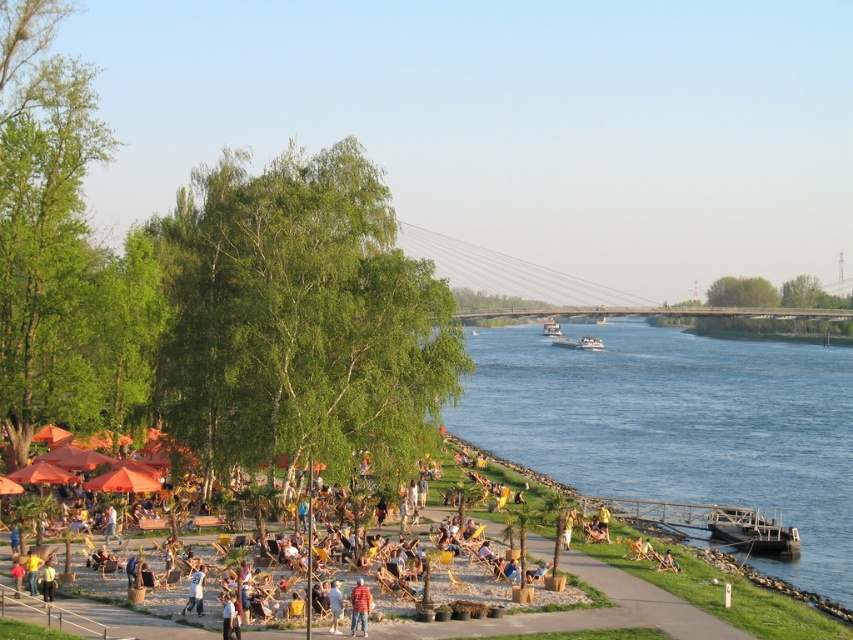
You are standing at the center of the sandy beach and want to reach the blue water at center. According to the coordinates provided, in which direction should you walk to get there?

The blue water at center is located at coordinates point 0.667 on the x axis and 0.796 on the y axis. Since you are at the center of the sandy beach, you should walk towards the right and slightly downward to reach the blue water at center.

You are standing at the point with coordinates point [341,612] and want to walk to the point with coordinates point [561,444]. Based on the scene description, will you be able to see the destination point from your current position?

Point [561,444] is behind point [341,612], so you will not be able to see the destination point from your current position.